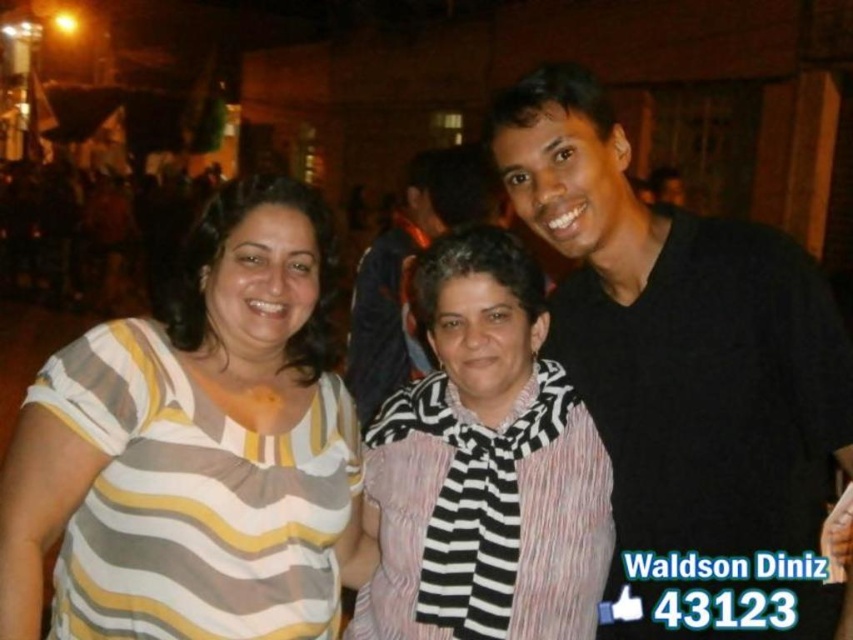
Looking at this image, you are a photographer adjusting the camera settings for a night portrait. You notice the black matte shirt at right and the striped fabric scarf at center in the frame. Which object should you focus on first to ensure proper exposure, considering their sizes in the image?

The black matte shirt at right is taller than the striped fabric scarf at center, so you should focus on the black matte shirt at right first to ensure proper exposure since it is larger in the frame.

You are a photographer trying to adjust the focus on your camera. You want to ensure that both the striped fabric shirt at center and the striped fabric scarf at center are in focus. Based on their sizes in the image, which one might require more careful adjustment to ensure clarity?

The striped fabric shirt at center is much taller than the striped fabric scarf at center, so the shirt may require more careful adjustment to ensure clarity due to its larger size.